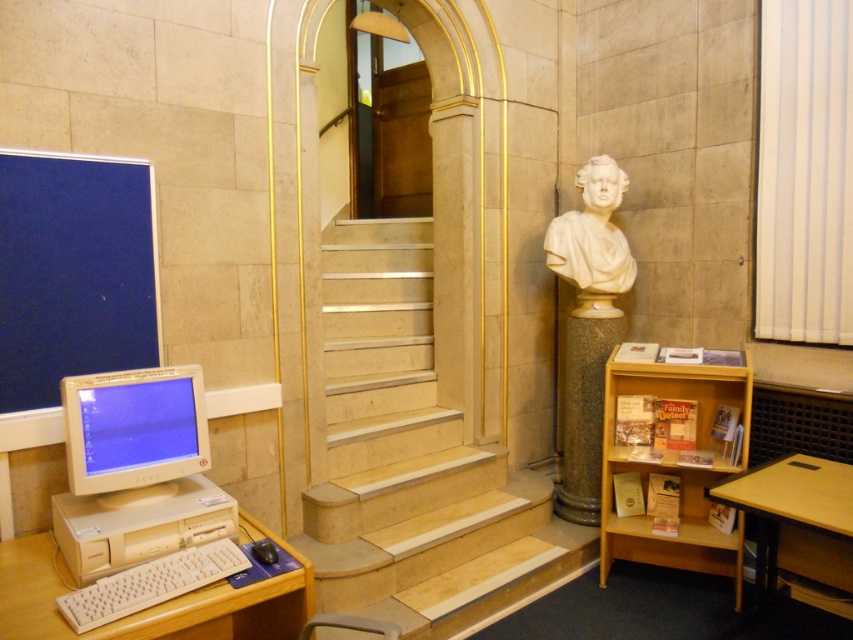
Between blue matte monitor at left and beige plastic desktop computer at left, which one has more height?

blue matte monitor at left is taller.

From the picture: Who is positioned more to the right, blue matte monitor at left or beige plastic desktop computer at left?

Positioned to the right is beige plastic desktop computer at left.

Find the location of a particular element. blue matte monitor at left is located at coordinates (73, 273).

Is blue matte monitor at left to the left of wooden at right from the viewer's perspective?

Yes, blue matte monitor at left is to the left of wooden at right.

Is point (86, 288) positioned before point (827, 518)?

No.

Is point (10, 170) in front of point (846, 465)?

That is True.

Locate an element on the screen. Image resolution: width=853 pixels, height=640 pixels. blue matte monitor at left is located at coordinates (73, 273).

Consider the image. Who is taller, wooden at right or white plastic keyboard at lower left?

With more height is wooden at right.

Who is more distant from viewer, (828, 477) or (219, 541)?

Point (828, 477)

Who is more forward, (757, 516) or (157, 564)?

Point (157, 564) is in front.

You are a GUI agent. You are given a task and a screenshot of the screen. Output one action in this format:
    pyautogui.click(x=<x>, y=<y>)
    Task: Click on the wooden at right
    The width and height of the screenshot is (853, 640).
    Given the screenshot: What is the action you would take?
    pyautogui.click(x=798, y=525)